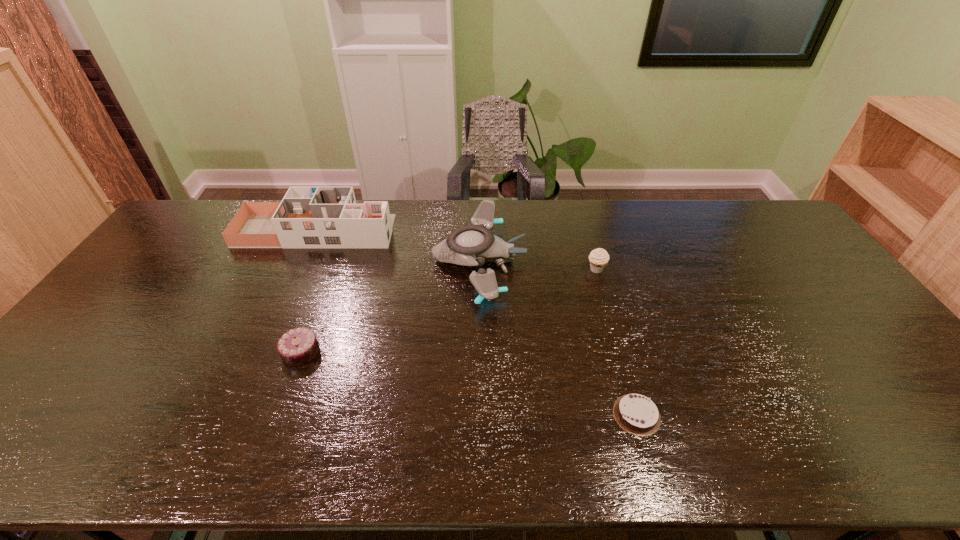
Choose which object is the third nearest neighbor to the drone. Please provide its 2D coordinates. Your answer should be formatted as a tuple, i.e. [(x, y)], where the tuple contains the x and y coordinates of a point satisfying the conditions above.

[(299, 346)]

Locate an element on the screen. This screenshot has height=540, width=960. object that stands as the second closest to the third tallest object is located at coordinates (638, 415).

The width and height of the screenshot is (960, 540). Identify the location of vacant space that satisfies the following two spatial constraints: 1. on the back side of the muffin; 2. at the front door of the tallest object. (586, 231).

Locate an element on the screen. This screenshot has height=540, width=960. vacant area in the image that satisfies the following two spatial constraints: 1. at the front door of the second shortest object; 2. on the right side of the dollhouse is located at coordinates (262, 352).

Locate an element on the screen. vacant region that satisfies the following two spatial constraints: 1. at the front door of the dollhouse; 2. on the back side of the shortest object is located at coordinates (233, 415).

Identify the location of vacant space that satisfies the following two spatial constraints: 1. on the front-facing side of the drone; 2. on the front side of the farther chocolate cake. (478, 352).

At what (x,y) coordinates should I click in order to perform the action: click on vacant space that satisfies the following two spatial constraints: 1. on the back side of the muffin; 2. on the left side of the shorter chocolate cake. Please return your answer as a coordinate pair (x, y). The width and height of the screenshot is (960, 540). Looking at the image, I should click on (595, 269).

You are a GUI agent. You are given a task and a screenshot of the screen. Output one action in this format:
    pyautogui.click(x=<x>, y=<y>)
    Task: Click on the vacant area in the image that satisfies the following two spatial constraints: 1. on the front-facing side of the second tallest object; 2. on the front side of the farther chocolate cake
    The image size is (960, 540).
    Given the screenshot: What is the action you would take?
    pyautogui.click(x=478, y=352)

Where is `vacant position in the image that satisfies the following two spatial constraints: 1. on the front side of the nearest object; 2. on the left side of the second nearest object`? This screenshot has width=960, height=540. vacant position in the image that satisfies the following two spatial constraints: 1. on the front side of the nearest object; 2. on the left side of the second nearest object is located at coordinates (277, 415).

Locate an element on the screen. free space that satisfies the following two spatial constraints: 1. on the back side of the muffin; 2. at the front door of the tallest object is located at coordinates (586, 231).